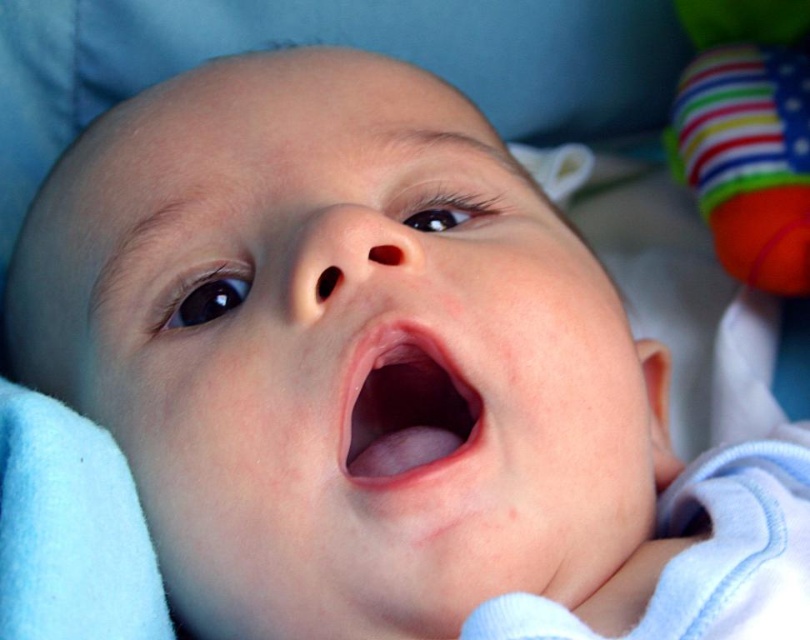
Can you confirm if multicolored fabric ball at upper right is shorter than pink smooth flesh at center?

No.

Based on the photo, can you confirm if multicolored fabric ball at upper right is taller than pink smooth flesh at center?

Yes, multicolored fabric ball at upper right is taller than pink smooth flesh at center.

Between point (794, 8) and point (414, 332), which one is positioned behind?

The point (794, 8) is behind.

The width and height of the screenshot is (810, 640). What are the coordinates of `multicolored fabric ball at upper right` in the screenshot? It's located at (747, 134).